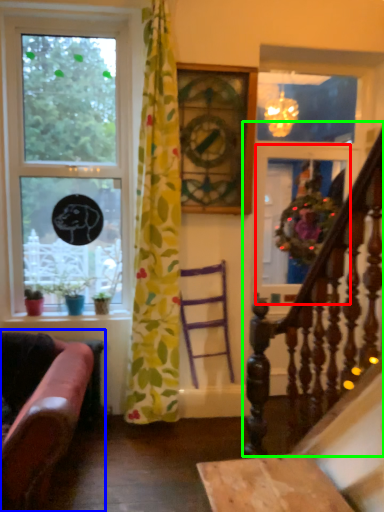
Question: Estimate the real-world distances between objects in this image. Which object is farther from glass door (highlighted by a red box), studio couch (highlighted by a blue box) or rail (highlighted by a green box)?

Choices:
 (A) studio couch
 (B) rail

Answer: (A)